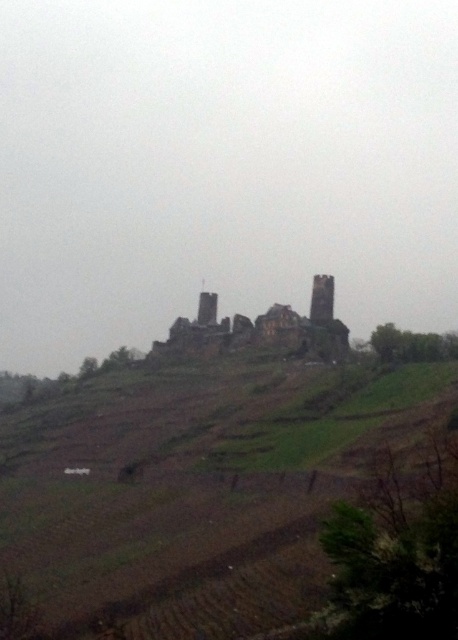
Is brown earthy hillside at center taller than rusty stone castle at center?

In fact, brown earthy hillside at center may be shorter than rusty stone castle at center.

Between brown earthy hillside at center and rusty stone castle at center, which one appears on the right side from the viewer's perspective?

From the viewer's perspective, rusty stone castle at center appears more on the right side.

What are the coordinates of `brown earthy hillside at center` in the screenshot? It's located at (196, 486).

You are a GUI agent. You are given a task and a screenshot of the screen. Output one action in this format:
    pyautogui.click(x=<x>, y=<y>)
    Task: Click on the brown earthy hillside at center
    This screenshot has width=458, height=640.
    Given the screenshot: What is the action you would take?
    pyautogui.click(x=196, y=486)

Which of these two, rusty stone castle at center or brown stone tower at center, stands taller?

Standing taller between the two is rusty stone castle at center.

Can you confirm if rusty stone castle at center is positioned to the left of brown stone tower at center?

Correct, you'll find rusty stone castle at center to the left of brown stone tower at center.

Who is more distant from viewer, [311,340] or [321,280]?

Positioned behind is point [321,280].

You are a GUI agent. You are given a task and a screenshot of the screen. Output one action in this format:
    pyautogui.click(x=<x>, y=<y>)
    Task: Click on the rusty stone castle at center
    
    Given the screenshot: What is the action you would take?
    pyautogui.click(x=260, y=328)

Can you confirm if brown earthy hillside at center is positioned to the right of brown stone tower at center?

No, brown earthy hillside at center is not to the right of brown stone tower at center.

How far apart are brown earthy hillside at center and brown stone tower at center?

brown earthy hillside at center and brown stone tower at center are 77.91 meters apart.

Does point (48, 451) lie in front of point (327, 305)?

Yes, point (48, 451) is closer to viewer.

This screenshot has height=640, width=458. I want to click on brown earthy hillside at center, so click(x=196, y=486).